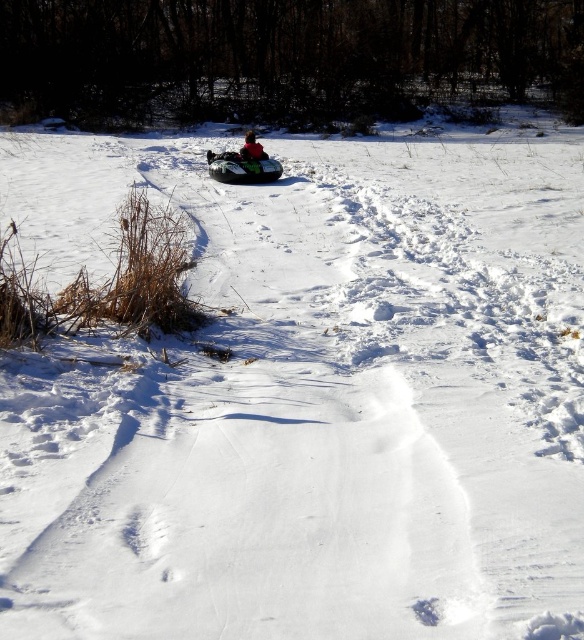
Which is behind, point (277, 172) or point (255, 157)?

The point (277, 172) is behind.

Is green plastic snowmobile at center wider than red matte jacket at center?

Yes.

Identify the location of green plastic snowmobile at center. Image resolution: width=584 pixels, height=640 pixels. (242, 166).

Image resolution: width=584 pixels, height=640 pixels. In order to click on green plastic snowmobile at center in this screenshot , I will do `click(242, 166)`.